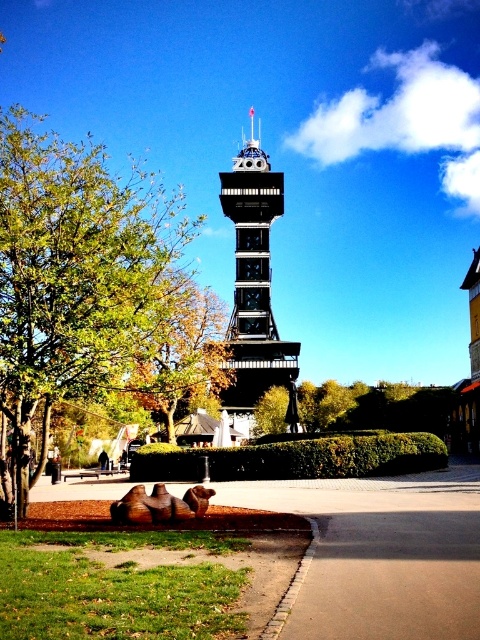
Is green leafy tree at left above black metal bell tower at center?

No.

Which is behind, point (162, 248) or point (271, 172)?

Positioned behind is point (271, 172).

Which is in front, point (96, 168) or point (237, 294)?

Point (96, 168) is in front.

At what (x,y) coordinates should I click in order to perform the action: click on green leafy tree at left. Please return your answer as a coordinate pair (x, y). This screenshot has width=480, height=640. Looking at the image, I should click on (75, 275).

Is green grass at lower left shorter than green leafy tree at center?

Correct, green grass at lower left is not as tall as green leafy tree at center.

Who is higher up, green grass at lower left or green leafy tree at center?

green leafy tree at center

Who is more distant from viewer, (x=40, y=632) or (x=286, y=396)?

Point (x=286, y=396)

I want to click on green grass at lower left, so click(x=117, y=588).

You are a GUI agent. You are given a task and a screenshot of the screen. Output one action in this format:
    pyautogui.click(x=<x>, y=<y>)
    Task: Click on the green leafy tree at left
    This screenshot has height=640, width=480.
    Given the screenshot: What is the action you would take?
    pyautogui.click(x=75, y=275)

What do you see at coordinates (75, 275) in the screenshot? The height and width of the screenshot is (640, 480). I see `green leafy tree at left` at bounding box center [75, 275].

Which is in front, point (45, 380) or point (222, 588)?

Point (222, 588) is in front.

This screenshot has height=640, width=480. In order to click on green leafy tree at left in this screenshot , I will do `click(75, 275)`.